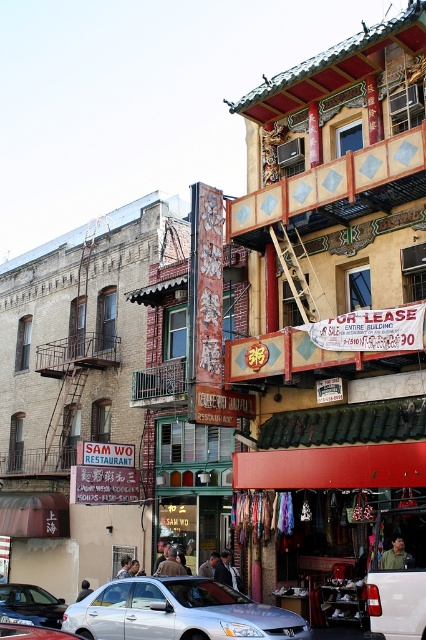
Can you confirm if silver metallic sedan at center is wider than wooden at center?

Correct, the width of silver metallic sedan at center exceeds that of wooden at center.

Locate an element on the screen. The image size is (426, 640). silver metallic sedan at center is located at coordinates (178, 612).

Is point (267, 632) positioned behind point (69, 634)?

That is True.

Who is positioned more to the right, silver metallic sedan at center or silver metallic car at center?

From the viewer's perspective, silver metallic sedan at center appears more on the right side.

Who is more distant from viewer, (63, 618) or (0, 636)?

The point (63, 618) is more distant.

Identify the location of silver metallic sedan at center. The height and width of the screenshot is (640, 426). click(178, 612).

Which is more to the right, silver metallic sedan at center or satin silver sedan at lower left?

silver metallic sedan at center is more to the right.

Between point (114, 611) and point (48, 600), which one is positioned behind?

The point (48, 600) is behind.

Is point (293, 616) positioned after point (49, 608)?

That is False.

The image size is (426, 640). Identify the location of silver metallic sedan at center. [178, 612].